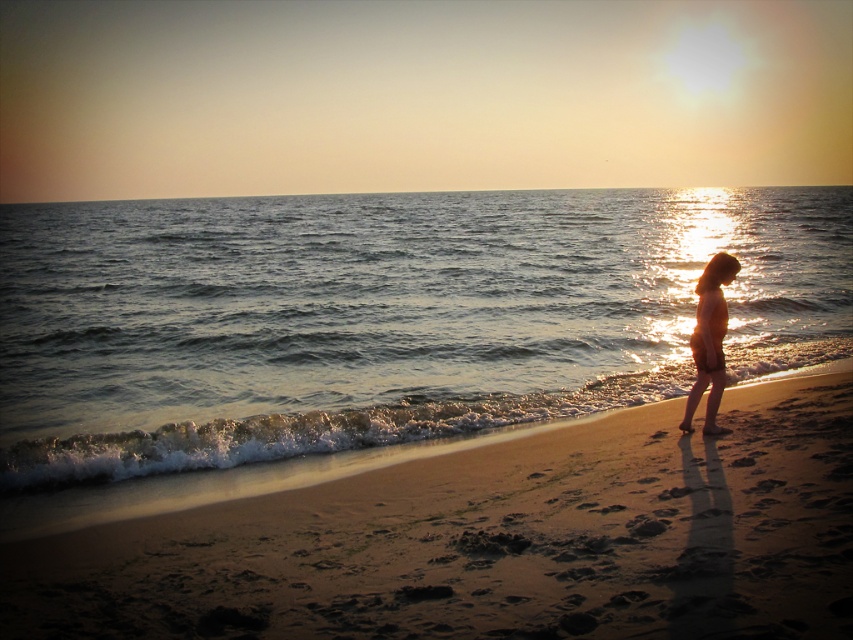
In the scene shown: Can you confirm if sandy beach at lower right is positioned below silhouette skin at right?

Correct, sandy beach at lower right is located below silhouette skin at right.

Is sandy beach at lower right positioned behind silhouette skin at right?

No, it is in front of silhouette skin at right.

Measure the distance between point (467, 620) and camera.

Point (467, 620) and camera are 16.10 feet apart from each other.

Locate an element on the screen. The width and height of the screenshot is (853, 640). sandy beach at lower right is located at coordinates (495, 540).

Is point (210, 268) positioned before point (474, 630)?

No, (210, 268) is behind (474, 630).

Which of these two, shiny blue water at center or sandy beach at lower right, stands taller?

Standing taller between the two is shiny blue water at center.

Which is in front, point (231, 458) or point (641, 429)?

Point (231, 458) is in front.

Where is `shiny blue water at center`? This screenshot has height=640, width=853. shiny blue water at center is located at coordinates (381, 317).

Is shiny blue water at center bigger than silhouette skin at right?

Yes, shiny blue water at center is bigger than silhouette skin at right.

Does point (115, 288) come behind point (714, 268)?

Yes.

The width and height of the screenshot is (853, 640). Find the location of `shiny blue water at center`. shiny blue water at center is located at coordinates (381, 317).